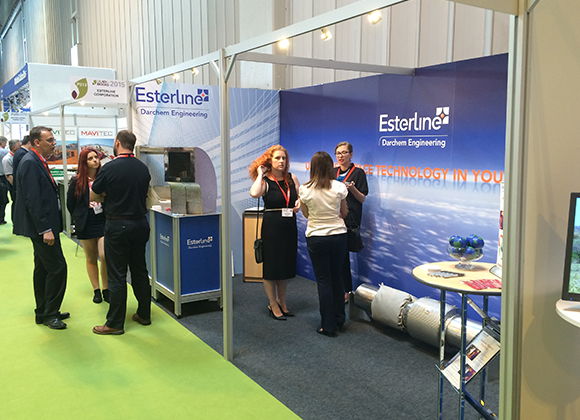
I want to click on grey rug, so click(x=354, y=374).